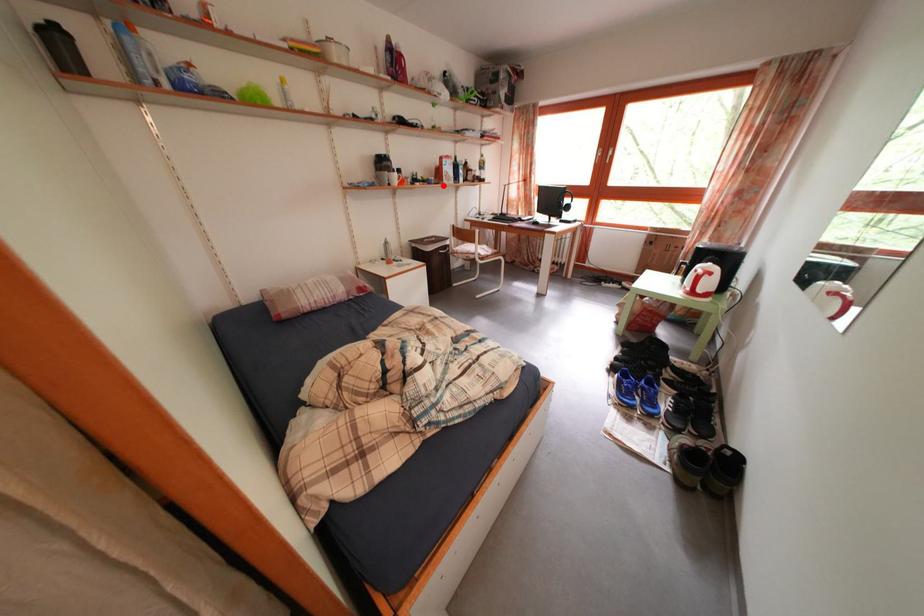
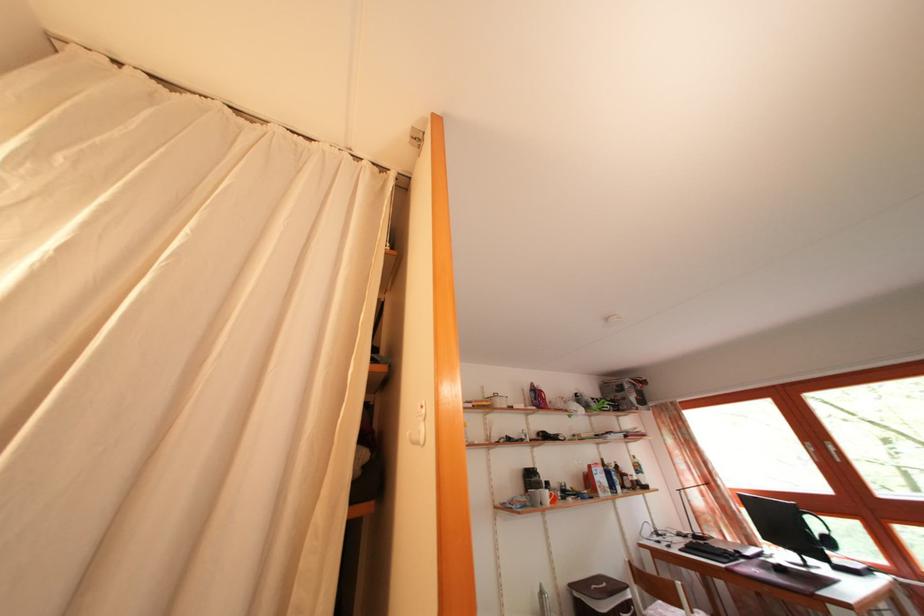
Question: I am providing you with two images of the same scene from different viewpoints. A red point is shown in image1. For the corresponding object point in image2, is it positioned nearer or farther from the camera?

Choices:
 (A) Nearer
 (B) Farther

Answer: (B)